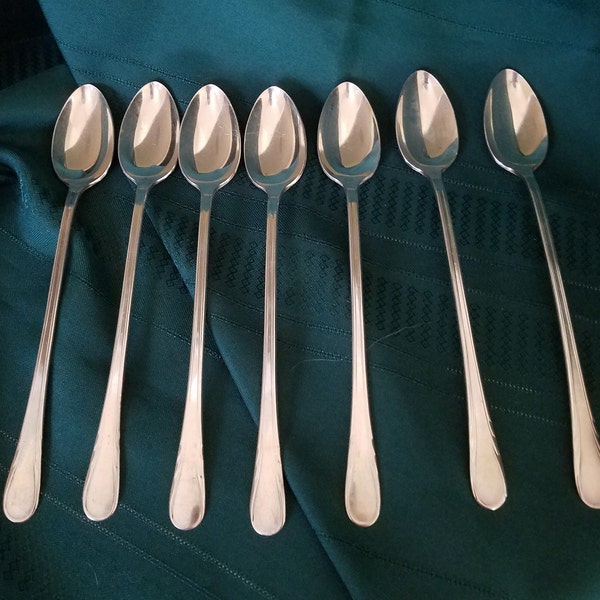
Find the location of `spoons`. spoons is located at coordinates (77, 145), (152, 151), (206, 151), (269, 154), (354, 154), (416, 140), (511, 139).